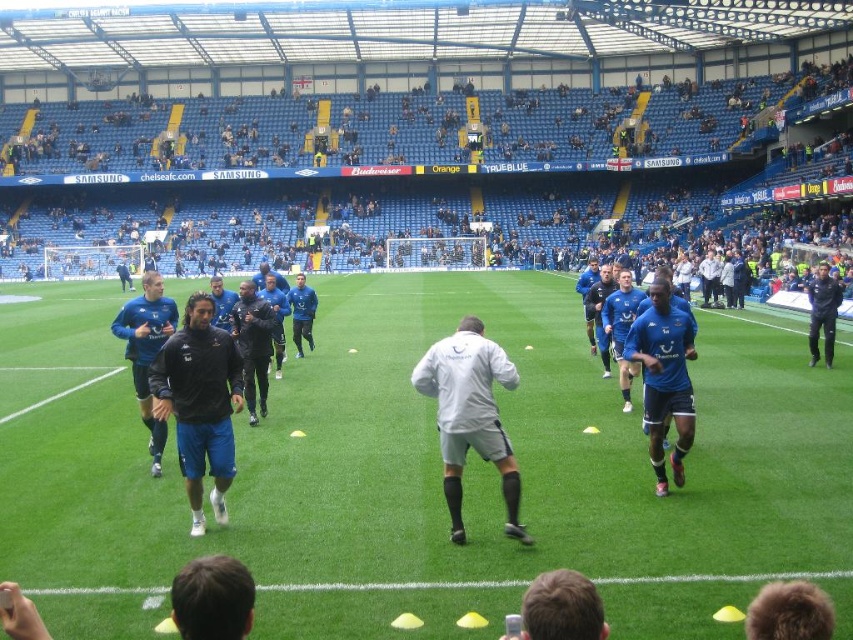
You are a photographer standing at the edge of the football field. You want to take a photo that includes both the black matte jacket at center and the white matte jacket at center. The minimum distance between the two jackets in the photo must be at least 6 feet. Can you capture them in a single shot?

The distance between the black matte jacket at center and the white matte jacket at center is 6.48 feet, which is more than the required 6 feet. Therefore, you can capture both jackets in a single shot while maintaining the minimum distance requirement.